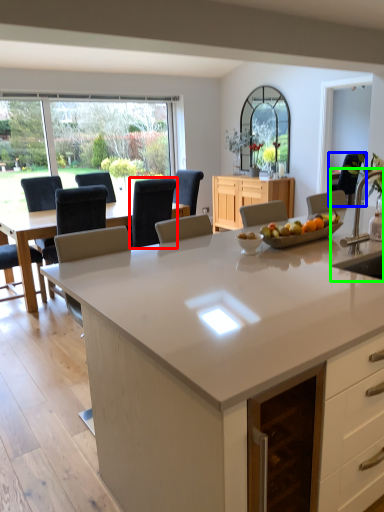
Question: Estimate the real-world distances between objects in this image. Which object is closer to chair (highlighted by a red box), chair (highlighted by a blue box) or sink (highlighted by a green box)?

Choices:
 (A) chair
 (B) sink

Answer: (B)